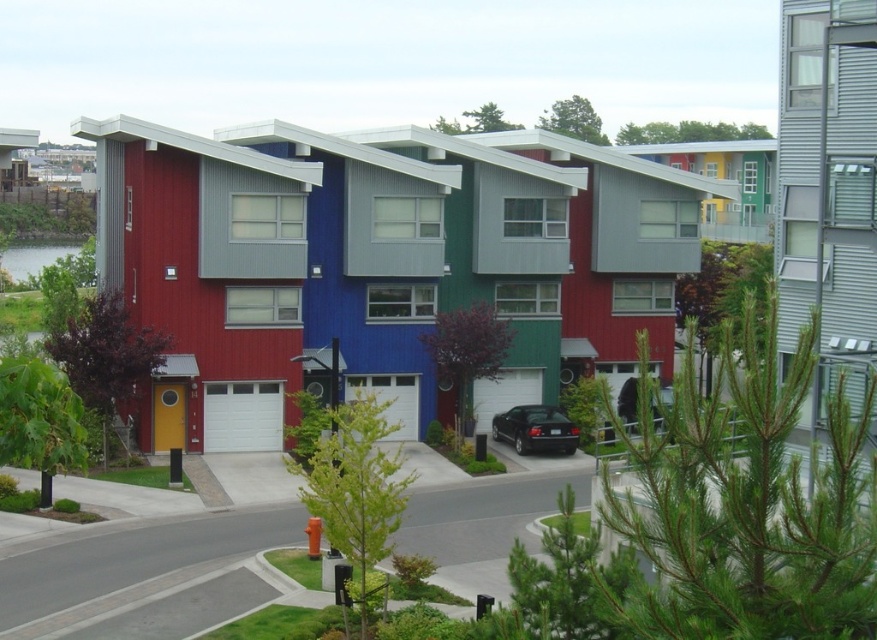
Question: Is black glossy car at center smaller than clear water at lower left?

Choices:
 (A) no
 (B) yes

Answer: (B)

Question: Which point is farther from the camera taking this photo?

Choices:
 (A) (89, 256)
 (B) (560, 445)

Answer: (A)

Question: Which point is farther to the camera?

Choices:
 (A) (32, 257)
 (B) (571, 433)

Answer: (A)

Question: Can you confirm if black glossy car at center is positioned below clear water at lower left?

Choices:
 (A) yes
 (B) no

Answer: (A)

Question: Among these points, which one is nearest to the camera?

Choices:
 (A) (62, 253)
 (B) (512, 416)

Answer: (B)

Question: Is black glossy car at center positioned at the back of clear water at lower left?

Choices:
 (A) yes
 (B) no

Answer: (B)